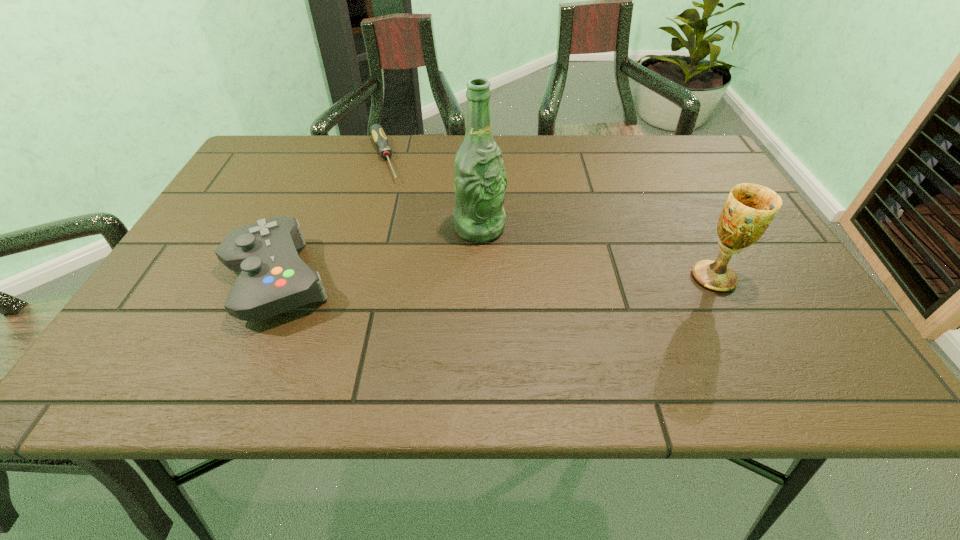
Locate an element on the screen. Image resolution: width=960 pixels, height=540 pixels. empty space between the beer bottle and the second tallest object is located at coordinates (596, 253).

Where is `free space between the rightmost object and the second shortest object`? This screenshot has height=540, width=960. free space between the rightmost object and the second shortest object is located at coordinates (495, 279).

What are the coordinates of `vacant space that is in between the farthest object and the chalice` in the screenshot? It's located at click(x=549, y=218).

Where is `object identified as the closest to the screwdriver`? object identified as the closest to the screwdriver is located at coordinates (480, 181).

Select which object is the second closest to the farthest object. Please provide its 2D coordinates. Your answer should be formatted as a tuple, i.e. [(x, y)], where the tuple contains the x and y coordinates of a point satisfying the conditions above.

[(273, 279)]

Where is `free location that satisfies the following two spatial constraints: 1. on the front side of the farthest object; 2. on the left side of the second object from right to left`? Image resolution: width=960 pixels, height=540 pixels. free location that satisfies the following two spatial constraints: 1. on the front side of the farthest object; 2. on the left side of the second object from right to left is located at coordinates [x=364, y=228].

At what (x,y) coordinates should I click in order to perform the action: click on vacant region that satisfies the following two spatial constraints: 1. on the front side of the beer bottle; 2. on the right side of the third shortest object. Please return your answer as a coordinate pair (x, y). This screenshot has width=960, height=540. Looking at the image, I should click on (479, 278).